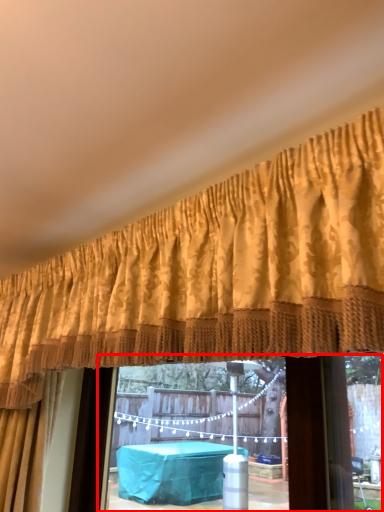
Question: From the image's perspective, where is window frame (annotated by the red box) located in relation to curtain in the image?

Choices:
 (A) below
 (B) above

Answer: (A)